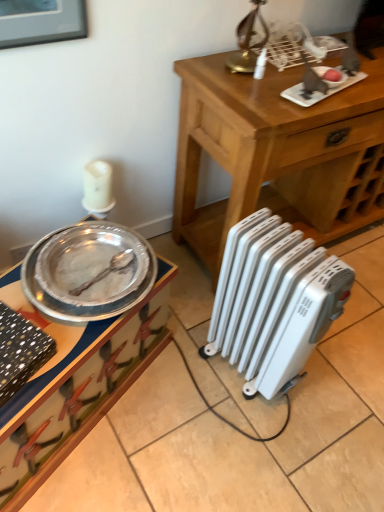
Question: Are wooden table at center and metallic silver tray at left far apart?

Choices:
 (A) yes
 (B) no

Answer: (B)

Question: Is wooden table at center further to the viewer compared to metallic silver tray at left?

Choices:
 (A) no
 (B) yes

Answer: (B)

Question: From the image's perspective, is wooden table at center under metallic silver tray at left?

Choices:
 (A) no
 (B) yes

Answer: (A)

Question: Is the position of wooden table at center less distant than that of metallic silver tray at left?

Choices:
 (A) yes
 (B) no

Answer: (B)

Question: Does wooden table at center have a greater height compared to metallic silver tray at left?

Choices:
 (A) yes
 (B) no

Answer: (A)

Question: In terms of height, does brushed metal picture frame at upper left look taller or shorter compared to white plastic radiator at lower right?

Choices:
 (A) short
 (B) tall

Answer: (A)

Question: Is brushed metal picture frame at upper left spatially inside white plastic radiator at lower right, or outside of it?

Choices:
 (A) inside
 (B) outside

Answer: (B)

Question: From a real-world perspective, is brushed metal picture frame at upper left positioned above or below white plastic radiator at lower right?

Choices:
 (A) above
 (B) below

Answer: (A)

Question: Considering the positions of point (11, 31) and point (339, 311), is point (11, 31) closer or farther from the camera than point (339, 311)?

Choices:
 (A) closer
 (B) farther

Answer: (A)

Question: From the image's perspective, relative to metallic silver tray at left, is wooden table at center above or below?

Choices:
 (A) above
 (B) below

Answer: (A)

Question: From a real-world perspective, relative to metallic silver tray at left, is wooden table at center vertically above or below?

Choices:
 (A) above
 (B) below

Answer: (A)

Question: Would you say wooden table at center is to the left or to the right of metallic silver tray at left in the picture?

Choices:
 (A) right
 (B) left

Answer: (A)

Question: Which is correct: wooden table at center is inside metallic silver tray at left, or outside of it?

Choices:
 (A) outside
 (B) inside

Answer: (A)

Question: Visually, is wooden table at center positioned to the left or to the right of white plastic radiator at lower right?

Choices:
 (A) right
 (B) left

Answer: (A)

Question: Considering their positions, is wooden table at center located in front of or behind white plastic radiator at lower right?

Choices:
 (A) behind
 (B) front

Answer: (A)